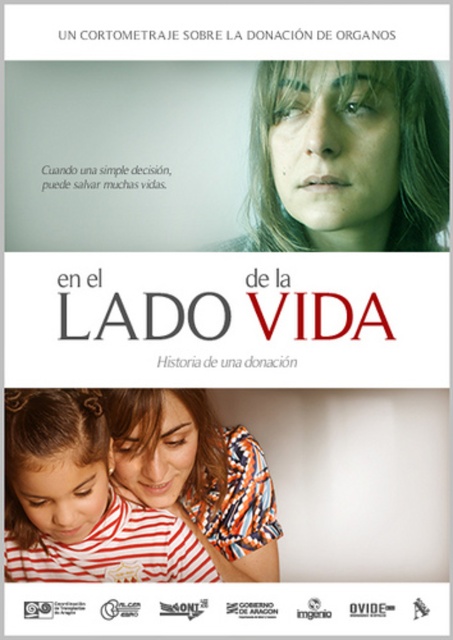
Does green matte face at upper center have a lesser width compared to striped cotton shirt at lower left?

Yes, green matte face at upper center is thinner than striped cotton shirt at lower left.

From the picture: Between green matte face at upper center and striped cotton shirt at lower left, which one appears on the left side from the viewer's perspective?

striped cotton shirt at lower left is more to the left.

This screenshot has width=453, height=640. Identify the location of green matte face at upper center. (347, 156).

Find the location of `green matte face at upper center`. green matte face at upper center is located at coordinates (347, 156).

Does green matte face at upper center have a lesser height compared to striped cotton shirt at center?

Correct, green matte face at upper center is not as tall as striped cotton shirt at center.

Find the location of a particular element. green matte face at upper center is located at coordinates (347, 156).

Who is more forward, (135,552) or (182,408)?

Point (182,408) is more forward.

Is striped cotton shirt at lower left wider than striped cotton shirt at center?

Correct, the width of striped cotton shirt at lower left exceeds that of striped cotton shirt at center.

Where is `striped cotton shirt at lower left`? The height and width of the screenshot is (640, 453). striped cotton shirt at lower left is located at coordinates 81,500.

What are the coordinates of `striped cotton shirt at lower left` in the screenshot? It's located at (81, 500).